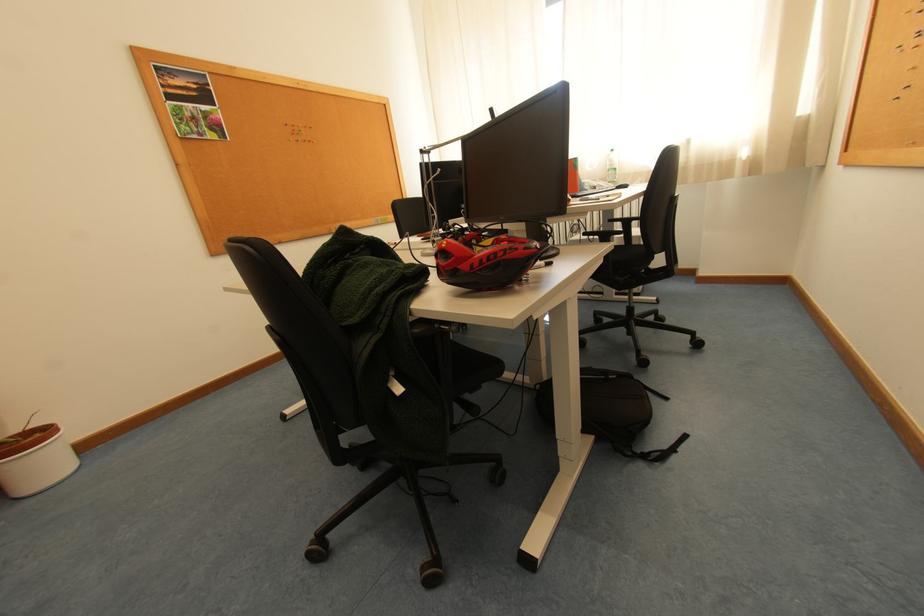
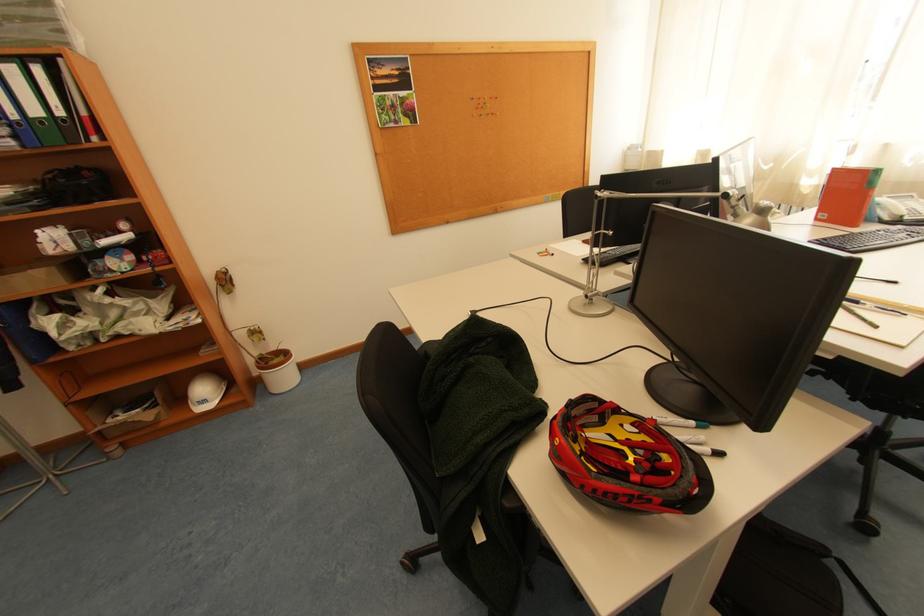
Locate, in the second image, the point that corresponds to the point at 298,142 in the first image.

(481, 118)